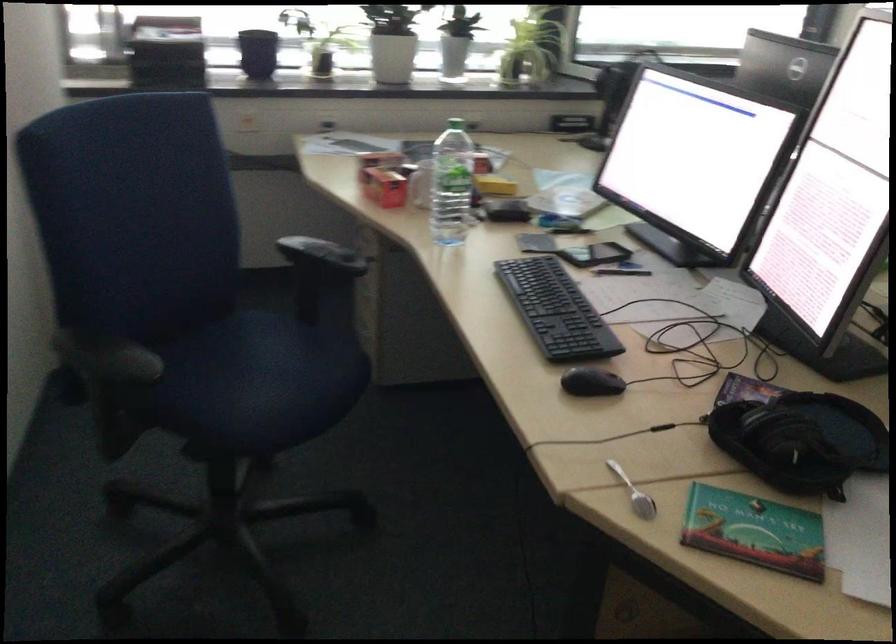
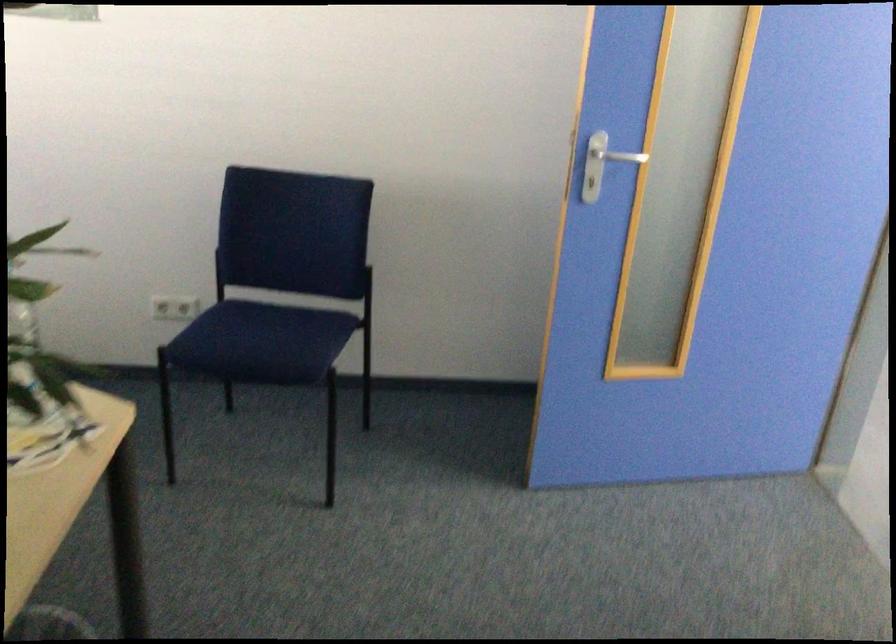
Question: The camera is either moving clockwise (left) or counter-clockwise (right) around the object. The first image is from the beginning of the video and the second image is from the end. Is the camera moving left or right when shooting the video?

Choices:
 (A) Left
 (B) Right

Answer: (A)